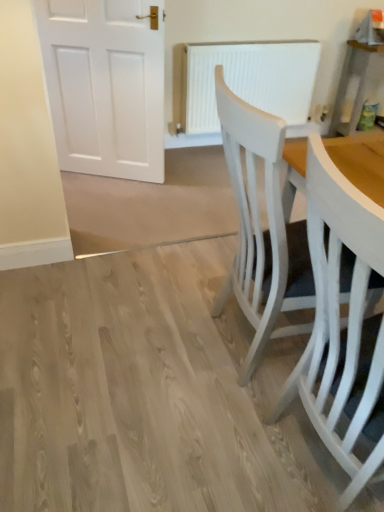
Question: Considering the relative positions of white textured radiator at center and white painted wood chair at right, which ranks as the second chair in front-to-back order, in the image provided, is white textured radiator at center to the left or to the right of white painted wood chair at right, which ranks as the second chair in front-to-back order,?

Choices:
 (A) right
 (B) left

Answer: (A)

Question: From the image's perspective, is white textured radiator at center located above or below white painted wood chair at right, which appears as the 1th chair when viewed from the back?

Choices:
 (A) below
 (B) above

Answer: (B)

Question: Which object is the farthest from the white painted wood chair at right, which appears as the 1th chair when viewed from the back?

Choices:
 (A) white textured radiator at center
 (B) white painted wood chair at right, acting as the 2th chair starting from the back

Answer: (A)

Question: Which object is positioned farthest from the white painted wood chair at right, which is the first chair in front-to-back order?

Choices:
 (A) white textured radiator at center
 (B) white painted wood chair at right, which ranks as the second chair in front-to-back order

Answer: (A)